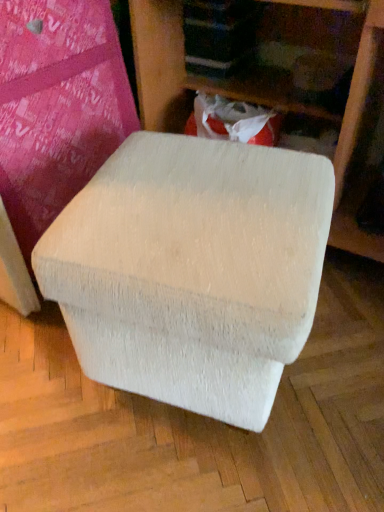
Question: Considering the positions of white textured bean bag at center and white fabric ottoman at center in the image, is white textured bean bag at center bigger or smaller than white fabric ottoman at center?

Choices:
 (A) big
 (B) small

Answer: (B)

Question: Choose the correct answer: Is white textured bean bag at center inside white fabric ottoman at center or outside it?

Choices:
 (A) outside
 (B) inside

Answer: (A)

Question: From the image's perspective, is white textured bean bag at center located above or below white fabric ottoman at center?

Choices:
 (A) above
 (B) below

Answer: (B)

Question: Is white fabric ottoman at center situated inside white textured bean bag at center or outside?

Choices:
 (A) outside
 (B) inside

Answer: (A)

Question: Considering the positions of point (352, 158) and point (152, 185), is point (352, 158) closer or farther from the camera than point (152, 185)?

Choices:
 (A) closer
 (B) farther

Answer: (B)

Question: Considering the positions of white fabric ottoman at center and white textured bean bag at center in the image, is white fabric ottoman at center bigger or smaller than white textured bean bag at center?

Choices:
 (A) small
 (B) big

Answer: (B)

Question: Relative to white textured bean bag at center, is white fabric ottoman at center in front or behind?

Choices:
 (A) front
 (B) behind

Answer: (B)